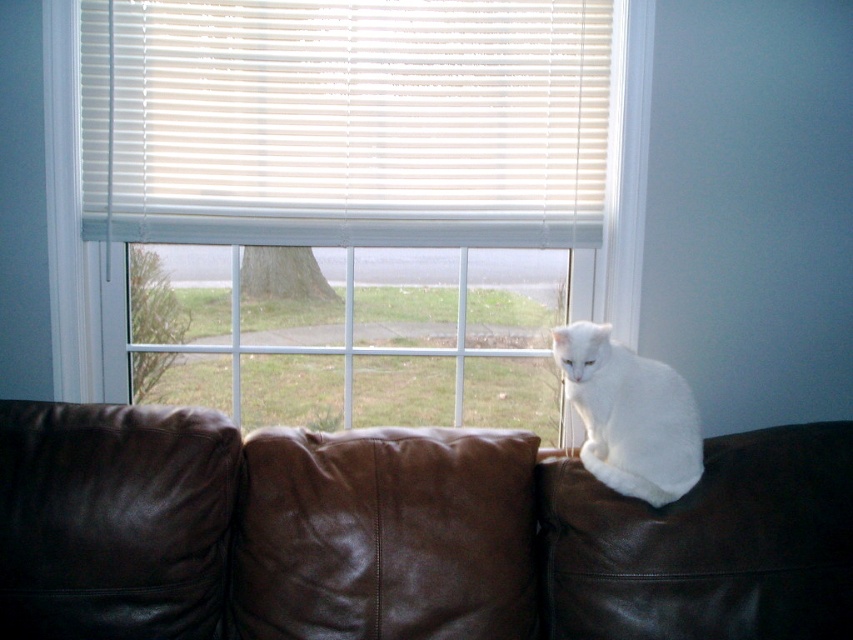
Question: Considering the real-world distances, which object is farthest from the leather cushion at center?

Choices:
 (A) brown leather couch at upper center
 (B) white blinds at upper center

Answer: (B)

Question: Which object appears closest to the camera in this image?

Choices:
 (A) white blinds at upper center
 (B) brown leather couch at upper center

Answer: (B)

Question: Does leather cushion at center come in front of white fluffy cat at upper right?

Choices:
 (A) yes
 (B) no

Answer: (A)

Question: Is white plastic blinds at upper center to the right of white fluffy cat at upper right from the viewer's perspective?

Choices:
 (A) yes
 (B) no

Answer: (B)

Question: Which object appears farthest from the camera in this image?

Choices:
 (A) white fluffy cat at upper right
 (B) leather cushion at center
 (C) white plastic blinds at upper center

Answer: (C)

Question: Is white blinds at upper center positioned in front of white fluffy cat at upper right?

Choices:
 (A) no
 (B) yes

Answer: (A)